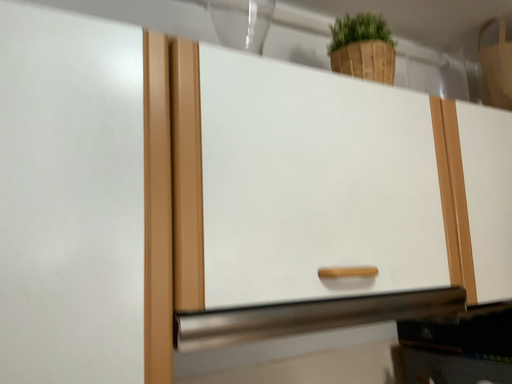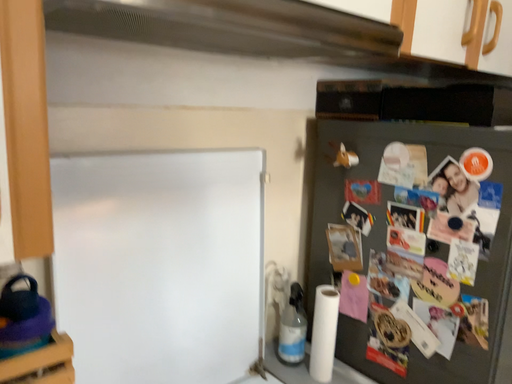
Question: Which way did the camera rotate in the video?

Choices:
 (A) rotated left
 (B) rotated right

Answer: (B)